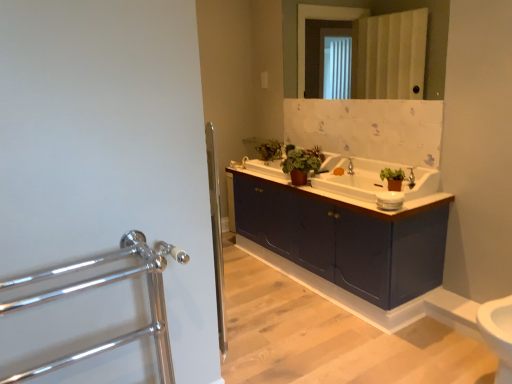
Question: Looking at the image, does green matte plant at upper center, marked as the second plant in a right-to-left arrangement, seem bigger or smaller compared to matte silver faucet at center?

Choices:
 (A) small
 (B) big

Answer: (B)

Question: From a real-world perspective, relative to matte silver faucet at center, is green matte plant at upper center, arranged as the first plant when viewed from the back, vertically above or below?

Choices:
 (A) below
 (B) above

Answer: (B)

Question: Which object is the closest to the matte white mirror at upper center?

Choices:
 (A) polished chrome towel rack at left
 (B) matte silver faucet at center
 (C) green matte plant at center, marked as the first plant in a front-to-back arrangement
 (D) clear glass screen door at center
 (E) green matte plant at upper center, the second plant viewed from the front

Answer: (E)

Question: Considering the real-world distances, which object is farthest from the white glossy sink at center?

Choices:
 (A) clear glass screen door at center
 (B) green matte plant at center, placed as the first plant when sorted from right to left
 (C) matte white mirror at upper center
 (D) green matte plant at upper center, the second plant viewed from the front
 (E) matte silver faucet at center

Answer: (C)